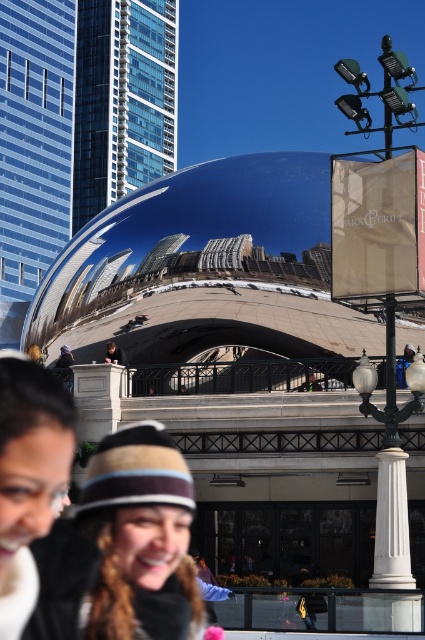
You are a photographer trying to capture both the striped knit hat at center and the matte black hat at lower center in a single shot. Based on their positions, which hat should you focus on first to ensure both are in frame?

The striped knit hat at center is located below matte black hat at lower center, so you should focus on the matte black hat at lower center first to ensure both are in frame.

You are standing at the point with coordinates point (11, 394) in the scene. You want to walk to the point with coordinates point (130, 579). According to the scene description, will the path be blocked by any objects?

Point (130, 579) is behind point (11, 394), so the path to point (130, 579) will be blocked by point (11, 394).